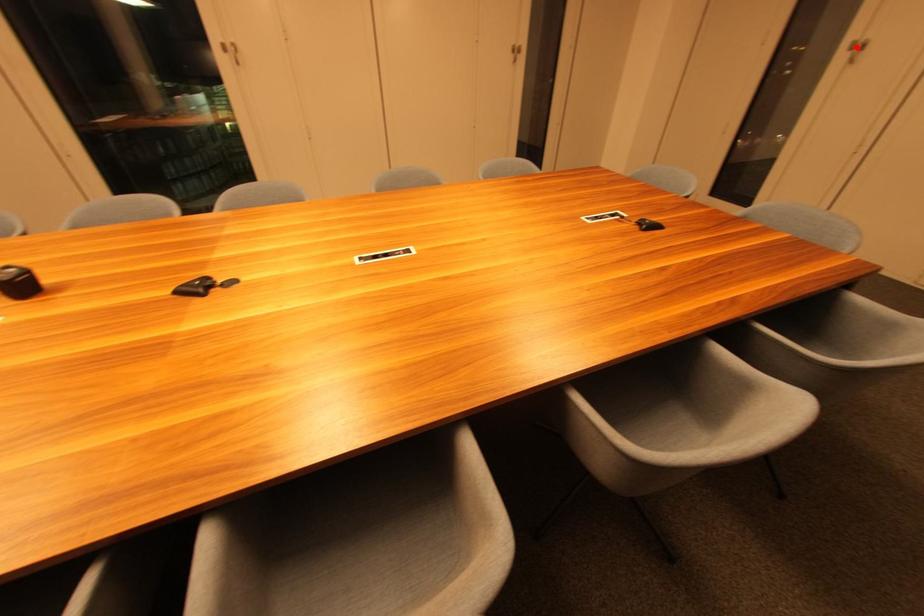
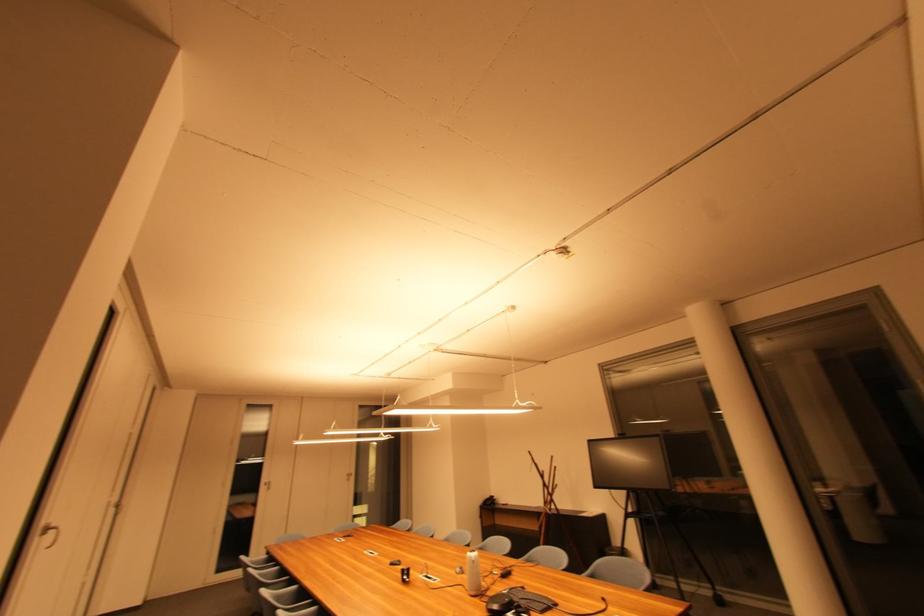
In the second image, find the point that corresponds to the highlighted location in the first image.

(271, 485)